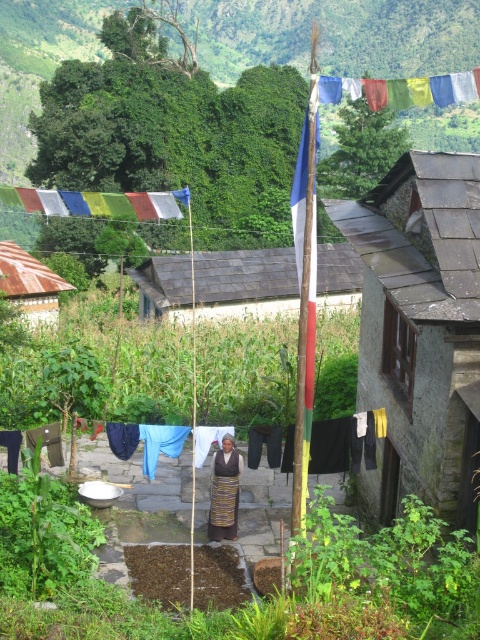
You are a visitor in this rural area and want to take a photo of the striped fabric person at center and the multicolored fabric at upper center. Which object should you focus on first if you want to capture both in the same frame?

The multicolored fabric at upper center is much taller than the striped fabric person at center, so you should focus on the multicolored fabric at upper center first to ensure it fits in the frame.

You are a hiker standing at the point labeled point (204, 307) and want to reach the point labeled point (287, 445). Which direction should you move to get there?

Since point (204, 307) is behind point (287, 445), you should move forward to reach point (287, 445).